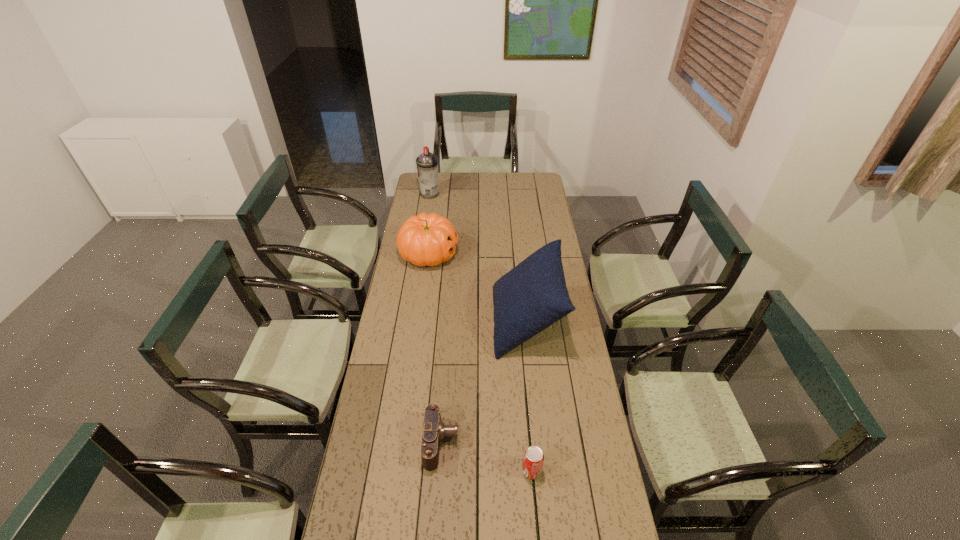
The width and height of the screenshot is (960, 540). I want to click on vacant space at the right edge of the desktop, so [x=547, y=385].

Where is `vacant space that is in between the third farthest object and the camera`? vacant space that is in between the third farthest object and the camera is located at coordinates (484, 382).

Where is `blank region between the cushion and the aerosol can`? Image resolution: width=960 pixels, height=540 pixels. blank region between the cushion and the aerosol can is located at coordinates (478, 258).

The width and height of the screenshot is (960, 540). In order to click on empty space between the third nearest object and the soda can in this screenshot , I will do `click(529, 396)`.

This screenshot has height=540, width=960. In order to click on free space between the third farthest object and the soda can in this screenshot , I will do `click(529, 396)`.

Locate an element on the screen. The image size is (960, 540). unoccupied position between the third shortest object and the camera is located at coordinates (435, 348).

Find the location of a particular element. The height and width of the screenshot is (540, 960). free space between the soda can and the third farthest object is located at coordinates (529, 396).

Locate an element on the screen. This screenshot has height=540, width=960. free spot between the camera and the second farthest object is located at coordinates (435, 348).

I want to click on blank region between the cushion and the camera, so click(x=484, y=382).

Where is `vacant space that's between the farthest object and the soda can`? The image size is (960, 540). vacant space that's between the farthest object and the soda can is located at coordinates (481, 333).